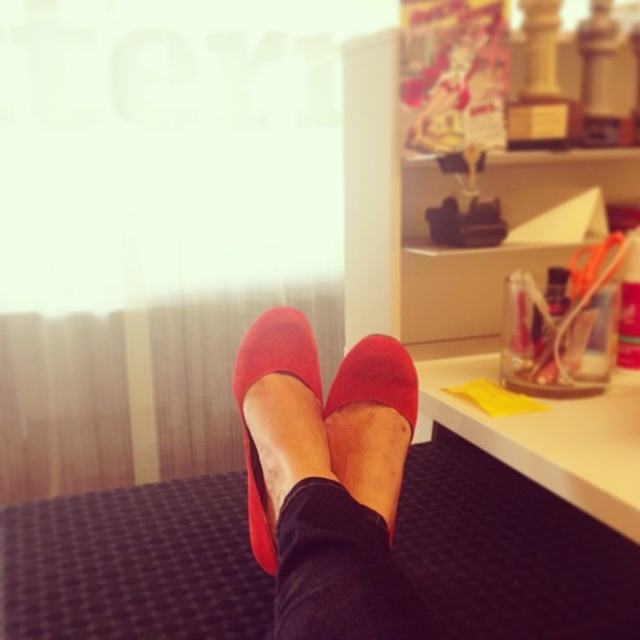
Question: Which of the following is the closest to the observer?

Choices:
 (A) (285, 324)
 (B) (353, 378)
 (C) (339, 568)
 (D) (314, 436)

Answer: (C)

Question: Which point appears closest to the camera in this image?

Choices:
 (A) (374, 352)
 (B) (237, 404)
 (C) (307, 564)
 (D) (396, 346)

Answer: (C)

Question: Is suede red shoes at center to the right of suede-like red slipper at center from the viewer's perspective?

Choices:
 (A) no
 (B) yes

Answer: (A)

Question: Considering the relative positions of black suede ankle at center and suede-like red slipper at center in the image provided, where is black suede ankle at center located with respect to suede-like red slipper at center?

Choices:
 (A) below
 (B) above

Answer: (A)

Question: Which point appears farthest from the camera in this image?

Choices:
 (A) (390, 371)
 (B) (387, 531)
 (C) (371, 541)
 (D) (266, 493)

Answer: (A)

Question: Can you confirm if suede red shoes at center is thinner than suede-like red shoe at center?

Choices:
 (A) no
 (B) yes

Answer: (A)